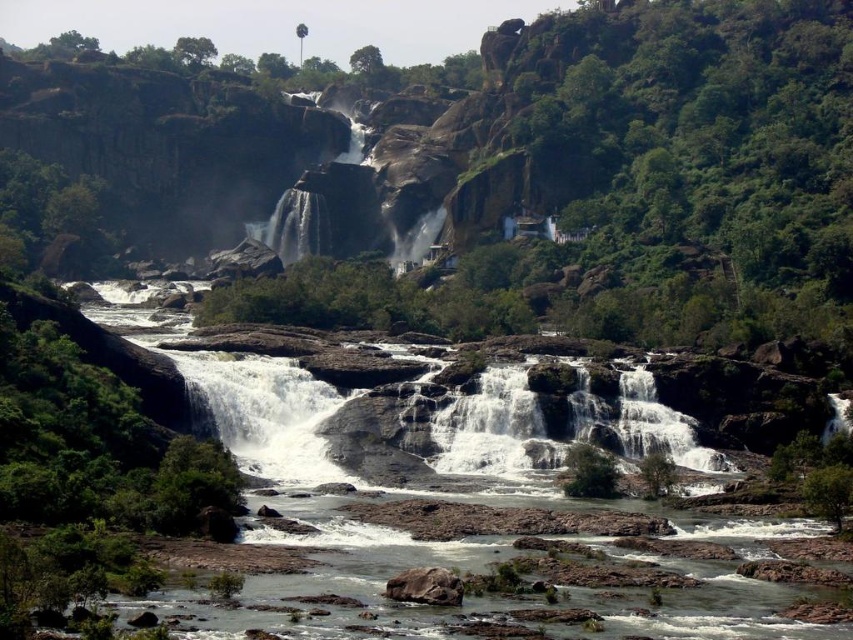
Question: Considering the relative positions of brown rock river at center and white smooth waterfalls at center in the image provided, where is brown rock river at center located with respect to white smooth waterfalls at center?

Choices:
 (A) above
 (B) below

Answer: (A)

Question: Observing the image, what is the correct spatial positioning of brown rock river at center in reference to white smooth waterfalls at center?

Choices:
 (A) below
 (B) above

Answer: (B)

Question: Does brown rock river at center appear on the left side of white smooth waterfalls at center?

Choices:
 (A) yes
 (B) no

Answer: (A)